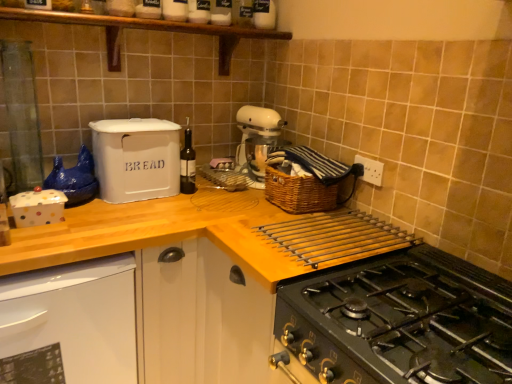
Where is `vacant area on the back side of dark glass bottle at center`? vacant area on the back side of dark glass bottle at center is located at coordinates (194, 188).